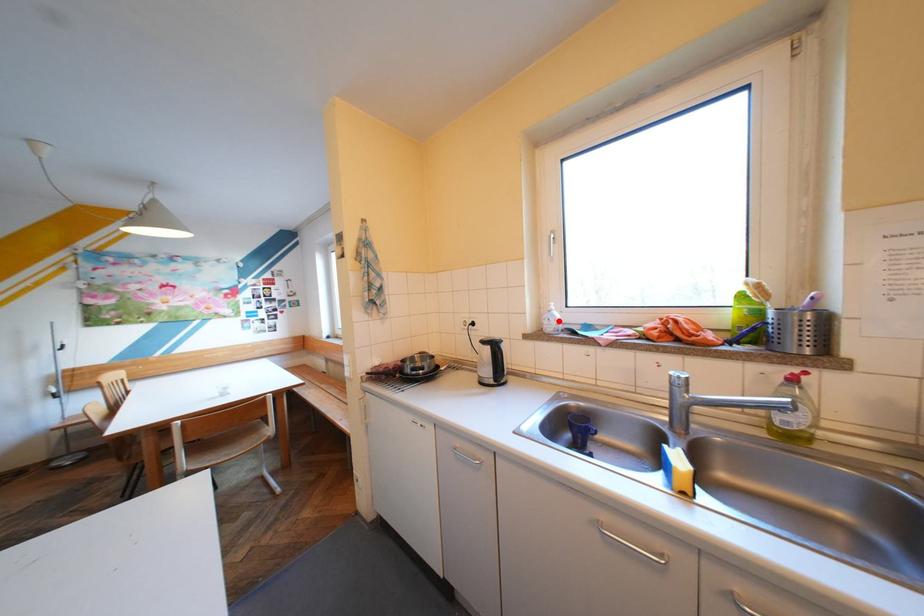
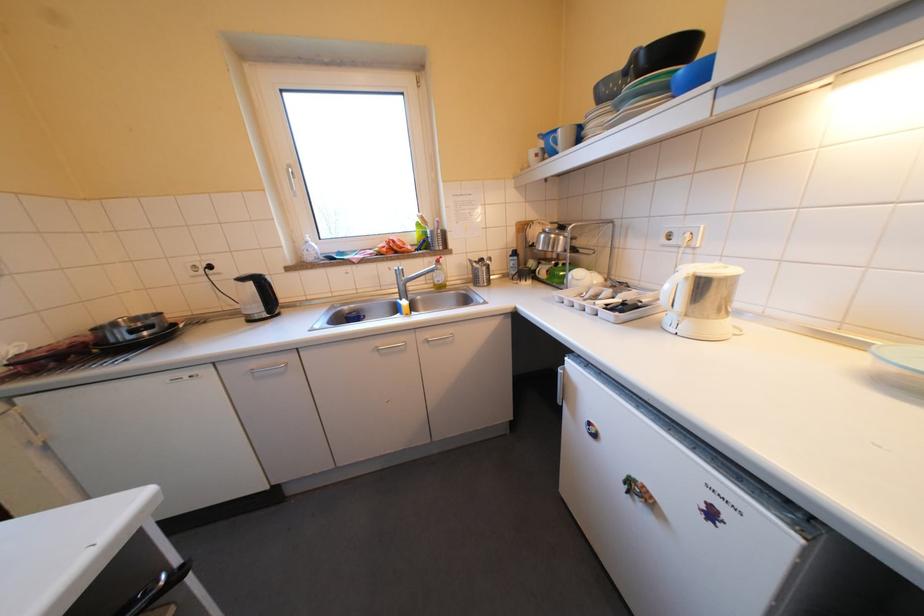
Question: I am providing you with two images of the same scene from different viewpoints. A red point is marked on the first image. Can you still see the location of the red point in image 2?

Choices:
 (A) Yes
 (B) No

Answer: (A)